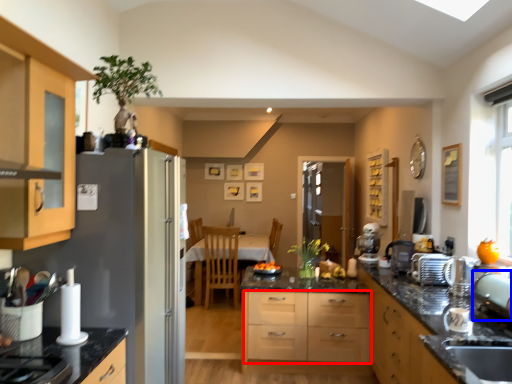
Question: Which object is further to the camera taking this photo, drawer (highlighted by a red box) or appliance (highlighted by a blue box)?

Choices:
 (A) drawer
 (B) appliance

Answer: (A)